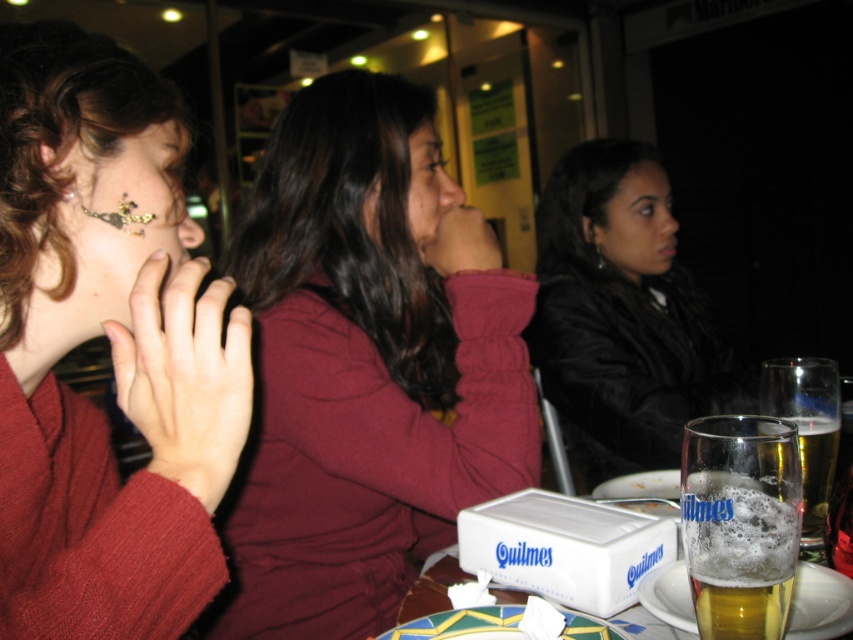
Question: Does black leather jacket at center have a lesser width compared to foamy golden beer at table right?

Choices:
 (A) no
 (B) yes

Answer: (A)

Question: Where is matte maroon sweater at center located in relation to foamy golden beer at table right in the image?

Choices:
 (A) right
 (B) left

Answer: (B)

Question: Among these objects, which one is farthest from the camera?

Choices:
 (A) black leather jacket at center
 (B) foamy golden beer at lower right
 (C) white cardboard box at lower center

Answer: (A)

Question: Is matte maroon sweater at center thinner than foamy golden beer at lower right?

Choices:
 (A) yes
 (B) no

Answer: (B)

Question: Which of these objects is positioned farthest from the foamy golden beer at table right?

Choices:
 (A) white cardboard box at lower center
 (B) matte red sweater at center

Answer: (B)

Question: Which object is farther from the camera taking this photo?

Choices:
 (A) foamy golden beer at lower right
 (B) white cardboard box at lower center
 (C) black leather jacket at center

Answer: (C)